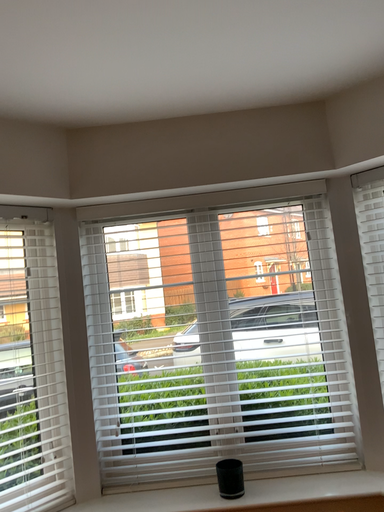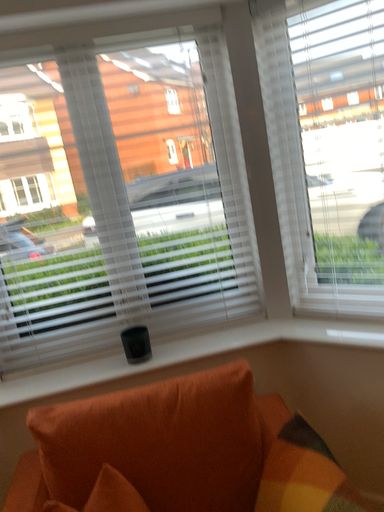
Question: How did the camera likely rotate when shooting the video?

Choices:
 (A) rotated upward
 (B) rotated downward

Answer: (B)